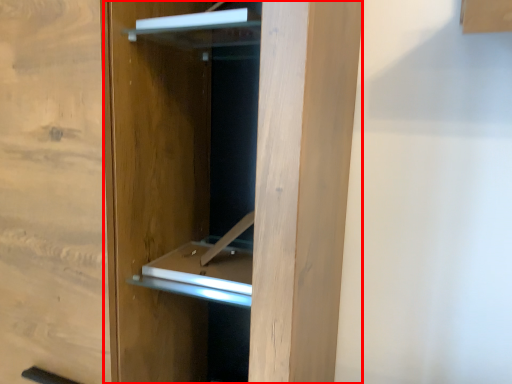
Question: From the image's perspective, what is the correct spatial positioning of door (annotated by the red box) in reference to cabinet?

Choices:
 (A) below
 (B) above

Answer: (A)